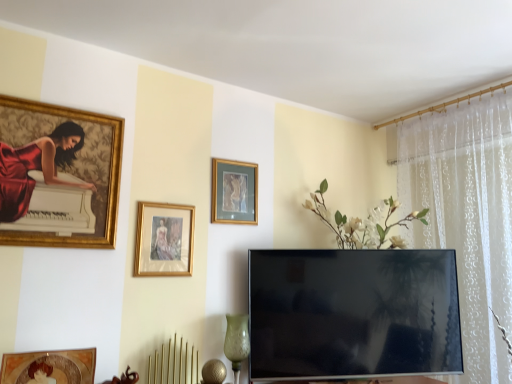
Question: Which direction should I rotate to look at gold-framed picture at center, acting as the 3th picture frame starting from the front, — up or down?

Choices:
 (A) up
 (B) down

Answer: (A)

Question: Is gold-framed painting at upper left, the third picture frame positioned from the back, next to gold-framed picture at center, acting as the 3th picture frame starting from the front, and touching it?

Choices:
 (A) no
 (B) yes

Answer: (A)

Question: Is gold-framed painting at upper left, arranged as the third picture frame when viewed from the right, far from gold-framed picture at center, which is the 1th picture frame from back to front?

Choices:
 (A) no
 (B) yes

Answer: (A)

Question: From the image's perspective, would you say gold-framed painting at upper left, arranged as the third picture frame when viewed from the right, is positioned over gold-framed picture at center, positioned as the 1th picture frame in right-to-left order?

Choices:
 (A) no
 (B) yes

Answer: (B)

Question: Could you tell me if gold-framed painting at upper left, which ranks as the first picture frame in front-to-back order, is turned towards gold-framed picture at center, positioned as the 1th picture frame in right-to-left order?

Choices:
 (A) yes
 (B) no

Answer: (B)

Question: Does gold-framed painting at upper left, the 1th picture frame in the left-to-right sequence, have a smaller size compared to gold-framed picture at center, the third picture frame viewed from the left?

Choices:
 (A) yes
 (B) no

Answer: (B)

Question: Is gold-framed painting at upper left, the third picture frame positioned from the back, further to the viewer compared to gold-framed picture at center, acting as the 3th picture frame starting from the front?

Choices:
 (A) no
 (B) yes

Answer: (A)

Question: Is flat screen tv at center located outside green textured glass vase at lower center?

Choices:
 (A) no
 (B) yes

Answer: (B)

Question: Is there a large distance between flat screen tv at center and green textured glass vase at lower center?

Choices:
 (A) no
 (B) yes

Answer: (A)

Question: Is the position of flat screen tv at center more distant than that of green textured glass vase at lower center?

Choices:
 (A) no
 (B) yes

Answer: (B)

Question: From the image's perspective, is flat screen tv at center under green textured glass vase at lower center?

Choices:
 (A) yes
 (B) no

Answer: (B)

Question: Is flat screen tv at center at the right side of green textured glass vase at lower center?

Choices:
 (A) no
 (B) yes

Answer: (B)

Question: Is flat screen tv at center facing towards green textured glass vase at lower center?

Choices:
 (A) yes
 (B) no

Answer: (B)

Question: From the image's perspective, does gold-framed picture at center, the 2th picture frame viewed from the front, appear higher than gold-framed painting at upper left, which ranks as the first picture frame in front-to-back order?

Choices:
 (A) yes
 (B) no

Answer: (B)